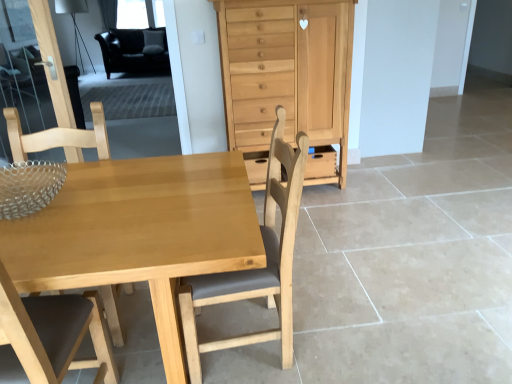
Question: Considering the positions of natural wood chest of drawers at center and light wood table at center in the image, is natural wood chest of drawers at center wider or thinner than light wood table at center?

Choices:
 (A) wide
 (B) thin

Answer: (B)

Question: Choose the correct answer: Is natural wood chest of drawers at center inside light wood table at center or outside it?

Choices:
 (A) inside
 (B) outside

Answer: (B)

Question: Which is nearer to the black leather armchair at upper left?

Choices:
 (A) light brown wood chair at left, the first chair from the left
 (B) light brown wood chair at center, which ranks as the first chair in right-to-left order
 (C) natural wood chest of drawers at center
 (D) matte wood drawer at center
 (E) transparent glass door at upper left

Answer: (E)

Question: Which is nearer to the light brown wood chair at center, the 2th chair from the left?

Choices:
 (A) transparent glass door at upper left
 (B) light wood table at center
 (C) light brown wood chair at left, the 2th chair when ordered from right to left
 (D) black leather armchair at upper left
 (E) matte wood drawer at center

Answer: (B)